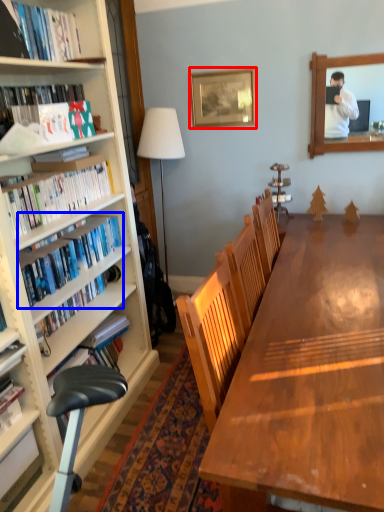
Question: Which object is further to the camera taking this photo, picture frame (highlighted by a red box) or book (highlighted by a blue box)?

Choices:
 (A) picture frame
 (B) book

Answer: (A)